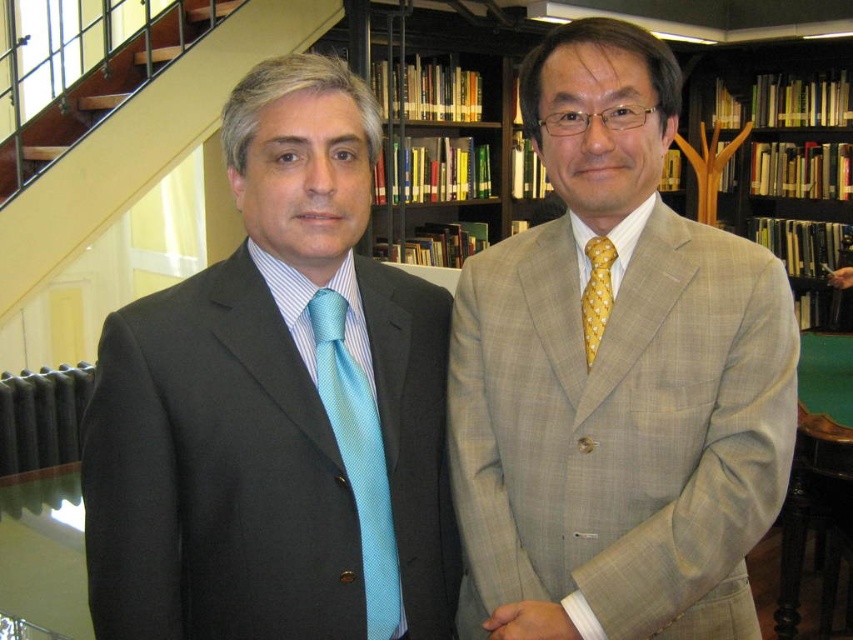
Question: Which of the following is the closest to the observer?

Choices:
 (A) (593, 289)
 (B) (450, 436)

Answer: (A)

Question: Does light beige textured suit at right lie behind yellow dotted tie at right?

Choices:
 (A) yes
 (B) no

Answer: (B)

Question: Is matte black suit at left positioned in front of light beige textured suit at right?

Choices:
 (A) no
 (B) yes

Answer: (B)

Question: Which of the following is the closest to the observer?

Choices:
 (A) (373, 474)
 (B) (498, 577)

Answer: (A)

Question: Is wooden stairs at upper left bigger than yellow dotted tie at right?

Choices:
 (A) no
 (B) yes

Answer: (B)

Question: Which of the following is the closest to the observer?

Choices:
 (A) (374, 605)
 (B) (79, 93)
 (C) (548, 42)
 (D) (584, 312)

Answer: (A)